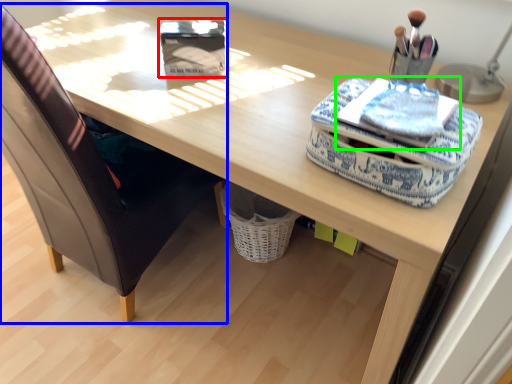
Question: Which object is the farthest from storage box (highlighted by a red box)? Choose among these: chair (highlighted by a blue box) or notepad (highlighted by a green box).

Choices:
 (A) chair
 (B) notepad

Answer: (A)